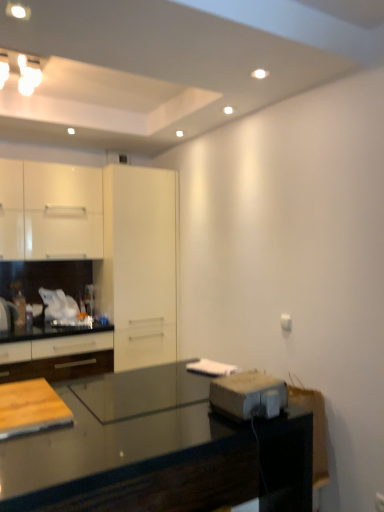
Question: Is metallic gray toaster at lower right taller than transparent glass cabinet at center?

Choices:
 (A) yes
 (B) no

Answer: (B)

Question: Can you confirm if metallic gray toaster at lower right is thinner than transparent glass cabinet at center?

Choices:
 (A) yes
 (B) no

Answer: (A)

Question: Is metallic gray toaster at lower right closer to camera compared to transparent glass cabinet at center?

Choices:
 (A) no
 (B) yes

Answer: (B)

Question: Considering the relative positions of metallic gray toaster at lower right and transparent glass cabinet at center in the image provided, is metallic gray toaster at lower right to the right of transparent glass cabinet at center from the viewer's perspective?

Choices:
 (A) no
 (B) yes

Answer: (B)

Question: Could you tell me if metallic gray toaster at lower right is facing transparent glass cabinet at center?

Choices:
 (A) no
 (B) yes

Answer: (A)

Question: Is metallic gray toaster at lower right further to camera compared to transparent glass cabinet at center?

Choices:
 (A) no
 (B) yes

Answer: (A)

Question: Are black glossy countertop at lower center and wooden cutting board at lower left making contact?

Choices:
 (A) yes
 (B) no

Answer: (B)

Question: Is black glossy countertop at lower center oriented towards wooden cutting board at lower left?

Choices:
 (A) yes
 (B) no

Answer: (B)

Question: Is black glossy countertop at lower center bigger than wooden cutting board at lower left?

Choices:
 (A) yes
 (B) no

Answer: (A)

Question: Does black glossy countertop at lower center come behind wooden cutting board at lower left?

Choices:
 (A) no
 (B) yes

Answer: (A)

Question: Is black glossy countertop at lower center outside wooden cutting board at lower left?

Choices:
 (A) no
 (B) yes

Answer: (B)

Question: Can you confirm if black glossy countertop at lower center is smaller than wooden cutting board at lower left?

Choices:
 (A) no
 (B) yes

Answer: (A)

Question: Does white glossy cabinet at upper left, arranged as the 1th cabinetry when viewed from the top, have a lesser height compared to white glossy cabinets at left, the second cabinetry in the top-to-bottom sequence?

Choices:
 (A) no
 (B) yes

Answer: (B)